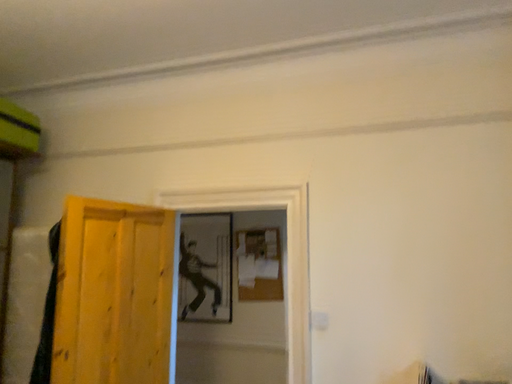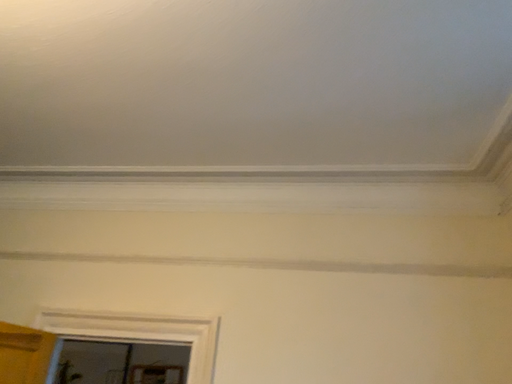
Question: How did the camera likely rotate when shooting the video?

Choices:
 (A) rotated downward
 (B) rotated upward

Answer: (B)